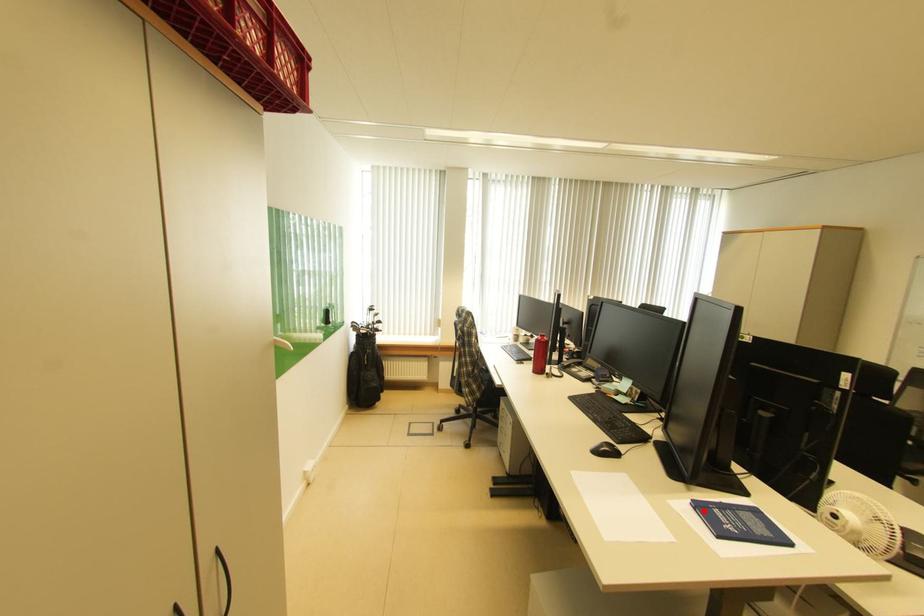
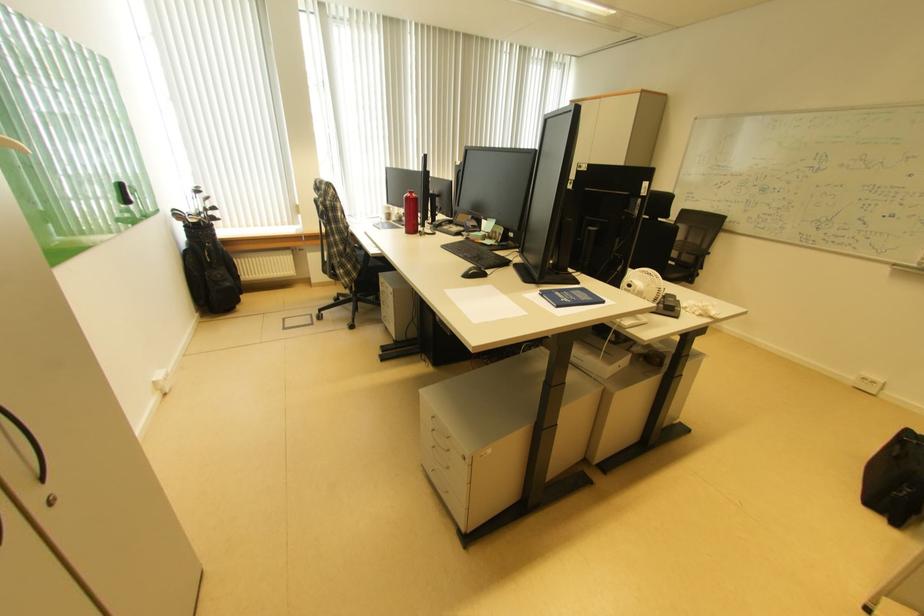
Question: I am providing you with two images of the same scene from different viewpoints. A red point is marked on the first image. At the location where the point appears in image 1, is it still visible in image 2?

Choices:
 (A) Yes
 (B) No

Answer: (A)